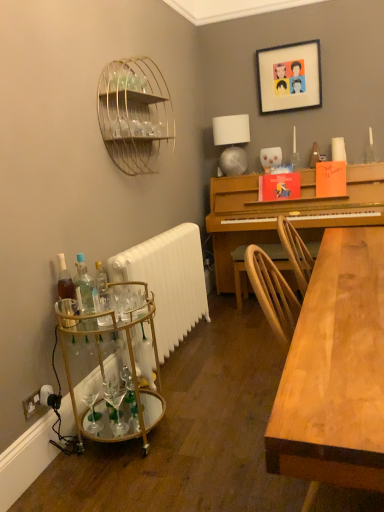
Question: From a real-world perspective, is satin silver lampshade at upper right physically below clear glass bottle at left, which is counted as the 1th bottle, starting from the right?

Choices:
 (A) no
 (B) yes

Answer: (A)

Question: From the image's perspective, is satin silver lampshade at upper right beneath clear glass bottle at left, which is counted as the 1th bottle, starting from the right?

Choices:
 (A) no
 (B) yes

Answer: (A)

Question: Is satin silver lampshade at upper right to the right of clear glass bottle at left, which ranks as the 3th bottle in left-to-right order, from the viewer's perspective?

Choices:
 (A) no
 (B) yes

Answer: (B)

Question: Can you confirm if satin silver lampshade at upper right is thinner than clear glass bottle at left, which is counted as the 1th bottle, starting from the right?

Choices:
 (A) yes
 (B) no

Answer: (B)

Question: Can you confirm if satin silver lampshade at upper right is wider than clear glass bottle at left, which is counted as the 1th bottle, starting from the right?

Choices:
 (A) no
 (B) yes

Answer: (B)

Question: Considering their positions, is gold wire shelf at upper left located in front of or behind white matte radiator at lower left?

Choices:
 (A) behind
 (B) front

Answer: (B)

Question: Considering the relative positions of gold wire shelf at upper left and white matte radiator at lower left in the image provided, is gold wire shelf at upper left to the left or to the right of white matte radiator at lower left?

Choices:
 (A) right
 (B) left

Answer: (B)

Question: Is gold wire shelf at upper left bigger or smaller than white matte radiator at lower left?

Choices:
 (A) big
 (B) small

Answer: (B)

Question: Is gold wire shelf at upper left situated inside white matte radiator at lower left or outside?

Choices:
 (A) inside
 (B) outside

Answer: (B)

Question: From a real-world perspective, relative to translucent glass bottle at lower left, acting as the first bottle starting from the left, is gold wire shelf at upper left vertically above or below?

Choices:
 (A) above
 (B) below

Answer: (A)

Question: From the image's perspective, relative to translucent glass bottle at lower left, the 3th bottle when ordered from right to left, is gold wire shelf at upper left above or below?

Choices:
 (A) below
 (B) above

Answer: (B)

Question: Considering the positions of gold wire shelf at upper left and translucent glass bottle at lower left, acting as the first bottle starting from the left, in the image, is gold wire shelf at upper left bigger or smaller than translucent glass bottle at lower left, acting as the first bottle starting from the left,?

Choices:
 (A) small
 (B) big

Answer: (B)

Question: Is gold wire shelf at upper left to the left or to the right of translucent glass bottle at lower left, acting as the first bottle starting from the left, in the image?

Choices:
 (A) right
 (B) left

Answer: (A)

Question: Looking at the image, does translucent glass bottles at lower left, placed as the second bottle when sorted from left to right, seem bigger or smaller compared to white matte radiator at lower left?

Choices:
 (A) big
 (B) small

Answer: (B)

Question: Is translucent glass bottles at lower left, arranged as the second bottle when viewed from the right, taller or shorter than white matte radiator at lower left?

Choices:
 (A) short
 (B) tall

Answer: (A)